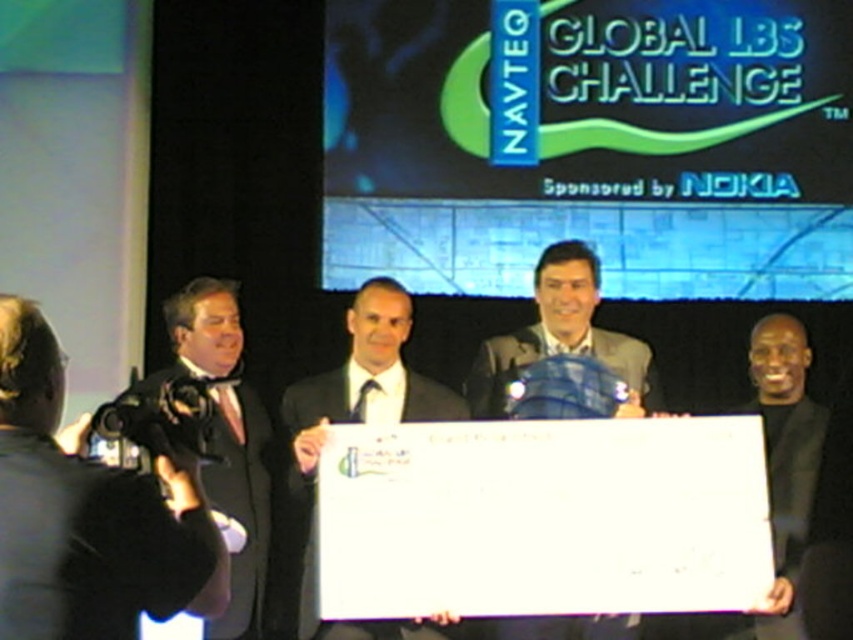
Question: Observing the image, what is the correct spatial positioning of black glossy camera at left in reference to gray fabric suit at center?

Choices:
 (A) below
 (B) above

Answer: (A)

Question: Which point is farther from the camera taking this photo?

Choices:
 (A) (48, 435)
 (B) (619, 353)
 (C) (305, 557)

Answer: (B)

Question: Is black glossy camera at left smaller than black suit at center?

Choices:
 (A) yes
 (B) no

Answer: (A)

Question: Which point is closer to the camera taking this photo?

Choices:
 (A) (379, 406)
 (B) (589, 300)
 (C) (186, 298)
 (D) (28, 625)

Answer: (D)

Question: Can you confirm if black glossy camera at left is positioned above black satin suit at left?

Choices:
 (A) yes
 (B) no

Answer: (B)

Question: Which of these objects is positioned closest to the black suit at center?

Choices:
 (A) gray fabric suit at center
 (B) black satin suit at left
 (C) black glossy camera at left

Answer: (B)